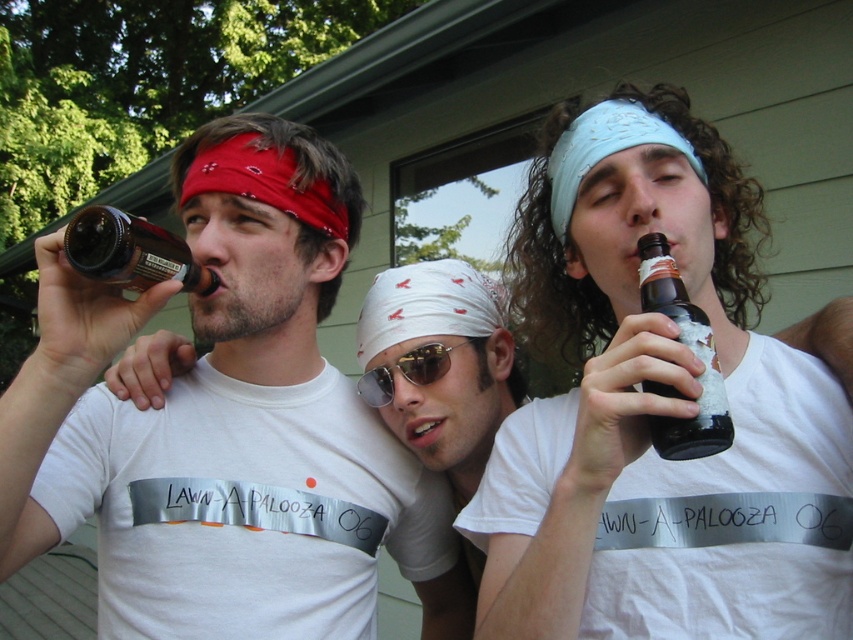
Does matte black bottle at left have a greater width compared to matte brown glass bottle at left?

Yes, matte black bottle at left is wider than matte brown glass bottle at left.

Does matte black bottle at left have a greater height compared to matte brown glass bottle at left?

Indeed, matte black bottle at left has a greater height compared to matte brown glass bottle at left.

This screenshot has height=640, width=853. Find the location of `matte black bottle at left`. matte black bottle at left is located at coordinates (227, 428).

Is point (213, 300) positioned in front of point (448, 358)?

Yes, point (213, 300) is in front of point (448, 358).

Is matte black bottle at left smaller than sunglasses at center?

Incorrect, matte black bottle at left is not smaller in size than sunglasses at center.

Who is more distant from viewer, (61, 413) or (415, 360)?

The point (415, 360) is behind.

Locate an element on the screen. matte black bottle at left is located at coordinates (227, 428).

Does point (566, 340) come in front of point (138, 273)?

No, it is behind (138, 273).

Between matte black bottle at center and matte brown glass bottle at left, which one has less height?

Standing shorter between the two is matte brown glass bottle at left.

Who is more distant from viewer, [585,192] or [102,262]?

The point [585,192] is more distant.

Where is `matte black bottle at center`? The image size is (853, 640). matte black bottle at center is located at coordinates (657, 408).